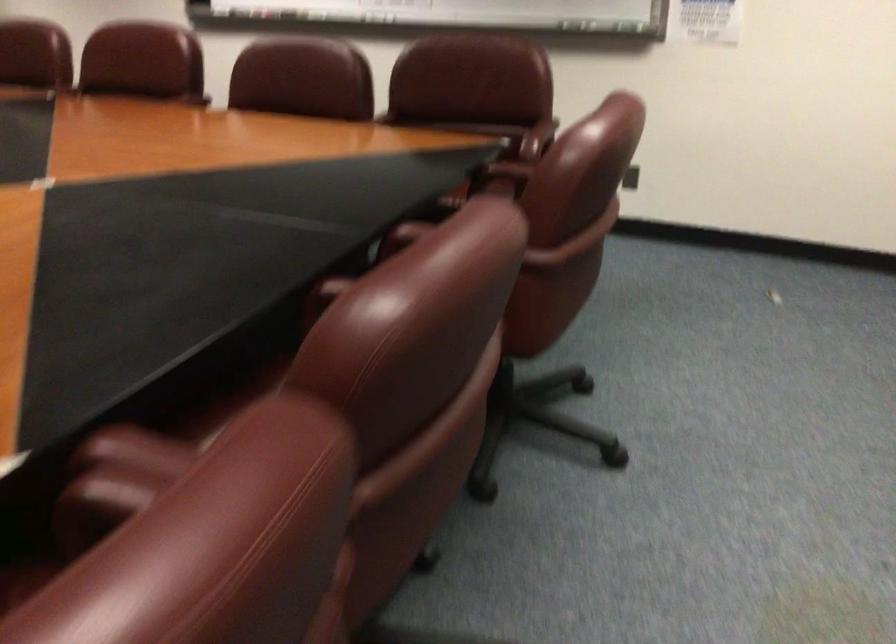
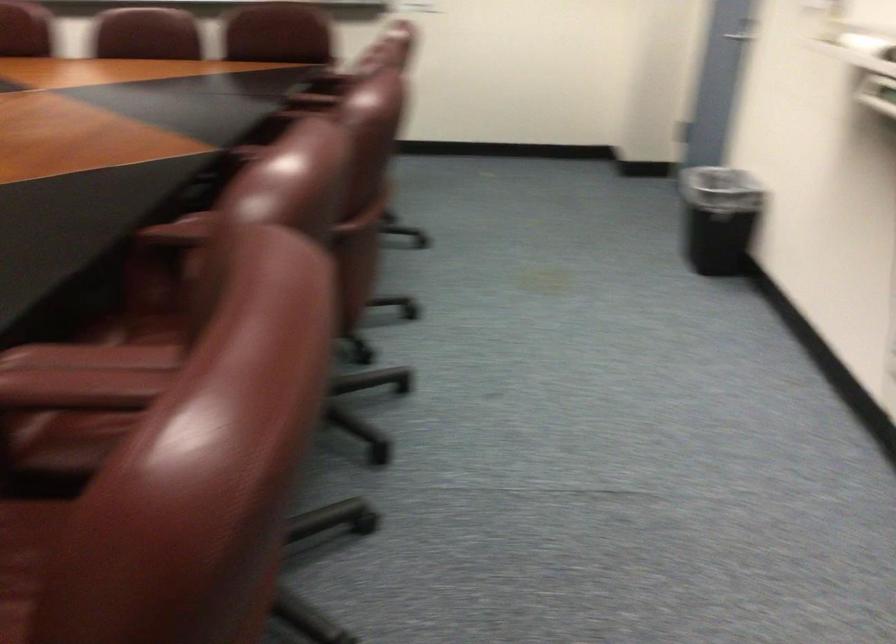
Question: Which direction would the cameraman need to move to produce the second image? Reply with the corresponding letter.

Choices:
 (A) Left
 (B) Right
 (C) Forward
 (D) Backward

Answer: (D)